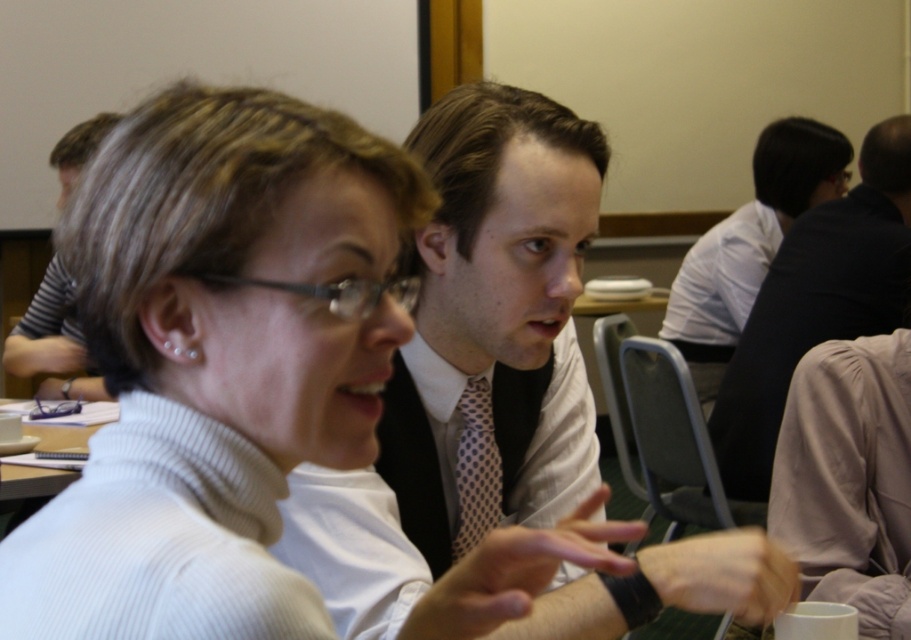
You are organizing a photo shoot and need to arrange two outfits based on their size. You have a dark gray suit at upper right and a matte black shirt at upper left. Which outfit takes up more space in the frame?

The matte black shirt at upper left takes up more space in the frame than the dark gray suit at upper right because the dark gray suit at upper right occupies less space than matte black shirt at upper left.

You are organizing a presentation and need to place a dark gray suit at upper right and a white paper at upper left on a table. Based on their sizes, which object should you place first to ensure there is enough space?

The dark gray suit at upper right has a larger size compared to the white paper at upper left, so you should place the dark gray suit at upper right first to ensure there is enough space.

You are organizing a photo shoot and need to arrange two outfits based on their height. You have a dark gray suit at upper right and a matte black shirt at upper left. Which one should you place higher to ensure proper alignment?

The dark gray suit at upper right is taller than the matte black shirt at upper left, so you should place the dark gray suit at upper right higher to ensure proper alignment.